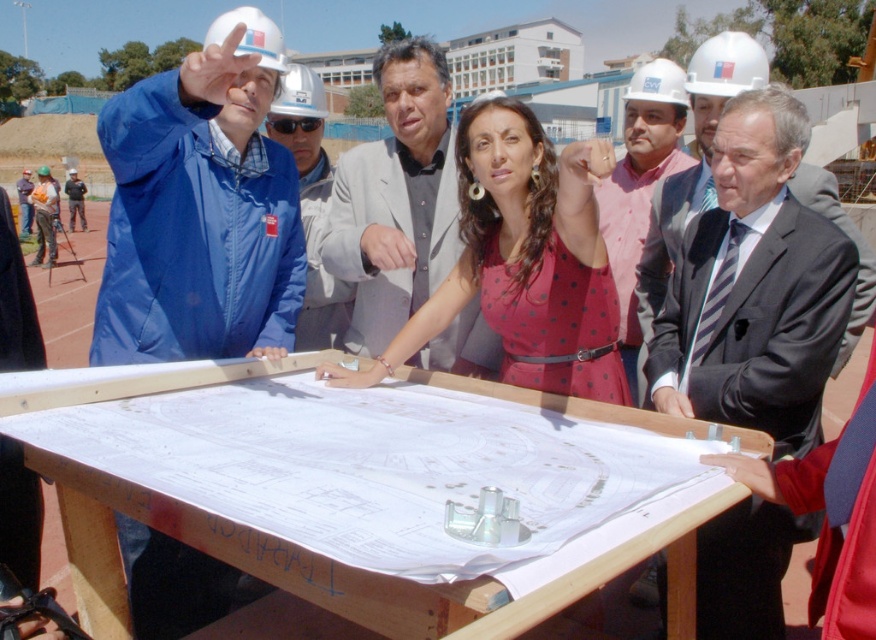
Question: Is striped tie suit at center above matte pink shirt at center?

Choices:
 (A) no
 (B) yes

Answer: (A)

Question: Among these objects, which one is nearest to the camera?

Choices:
 (A) matte pink shirt at center
 (B) blue fabric jacket at left
 (C) striped tie suit at center

Answer: (B)

Question: Among these points, which one is farthest from the camera?

Choices:
 (A) (272, 349)
 (B) (492, 221)
 (C) (668, 60)
 (D) (276, 124)

Answer: (C)

Question: Which point is closer to the camera taking this photo?

Choices:
 (A) (345, 294)
 (B) (203, 330)
 (C) (627, 106)
 (D) (428, 307)

Answer: (B)

Question: Does matte pink shirt at center come in front of blue fabric jacket at upper left?

Choices:
 (A) no
 (B) yes

Answer: (B)

Question: Is blue fabric jacket at left smaller than gray suit at center?

Choices:
 (A) no
 (B) yes

Answer: (A)